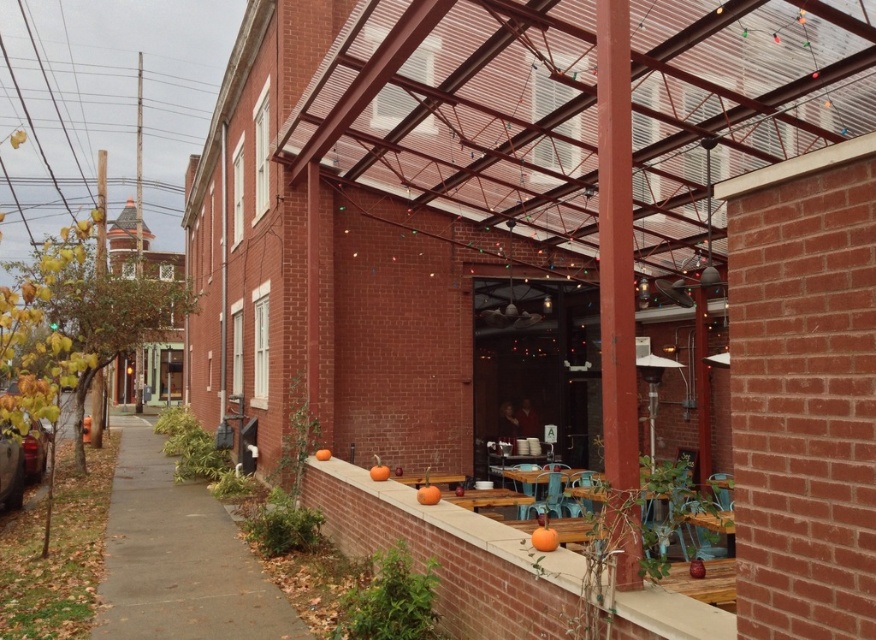
Who is shorter, transparent plastic canopy at upper center or gray concrete sidewalk at lower left?

transparent plastic canopy at upper center is shorter.

Measure the distance between transparent plastic canopy at upper center and gray concrete sidewalk at lower left.

The distance of transparent plastic canopy at upper center from gray concrete sidewalk at lower left is 8.49 meters.

Find the location of `transparent plastic canopy at upper center`. transparent plastic canopy at upper center is located at coordinates (463, 112).

I want to click on transparent plastic canopy at upper center, so (x=463, y=112).